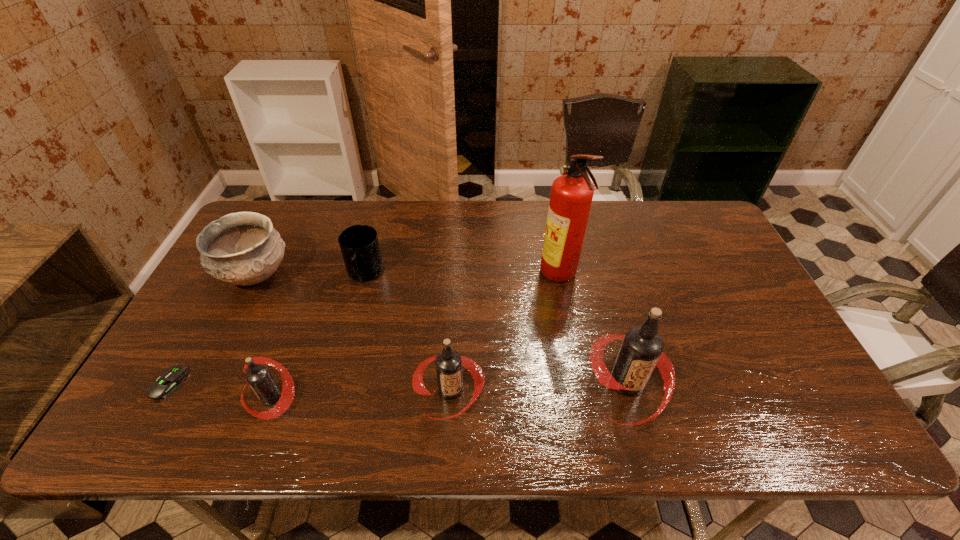
Locate an element on the screen. The image size is (960, 540). vacant area situated on the label of the leftmost root beer is located at coordinates (212, 396).

Find the location of a particular element. This screenshot has width=960, height=540. vacant space positioned 0.200m on the label of the leftmost root beer is located at coordinates (157, 396).

This screenshot has height=540, width=960. Find the location of `vacant space situated 0.130m on the label of the leftmost root beer`. vacant space situated 0.130m on the label of the leftmost root beer is located at coordinates (187, 396).

I want to click on vacant area situated on the front-facing side of the fire extinguisher, so click(427, 276).

The width and height of the screenshot is (960, 540). I want to click on free location located 0.140m on the front-facing side of the fire extinguisher, so click(x=493, y=276).

Identify the location of vacant space positioned on the front-facing side of the fire extinguisher. (430, 276).

I want to click on free space located 0.130m on the side of the fourth object from left to right with the handle, so click(x=351, y=327).

The width and height of the screenshot is (960, 540). Identify the location of vacant space located on the front of the pottery. 203,380.

What are the coordinates of `blank space located 0.130m on the back of the computer mouse` in the screenshot? It's located at (201, 326).

This screenshot has width=960, height=540. What are the coordinates of `computer mouse at the near edge` in the screenshot? It's located at (170, 379).